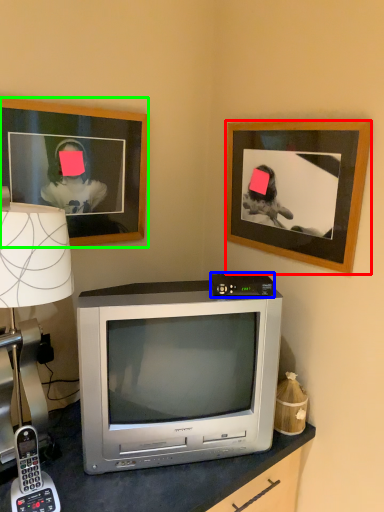
Question: Which object is positioned farthest from picture frame (highlighted by a red box)? Select from gadget (highlighted by a blue box) and picture frame (highlighted by a green box).

Choices:
 (A) gadget
 (B) picture frame

Answer: (B)